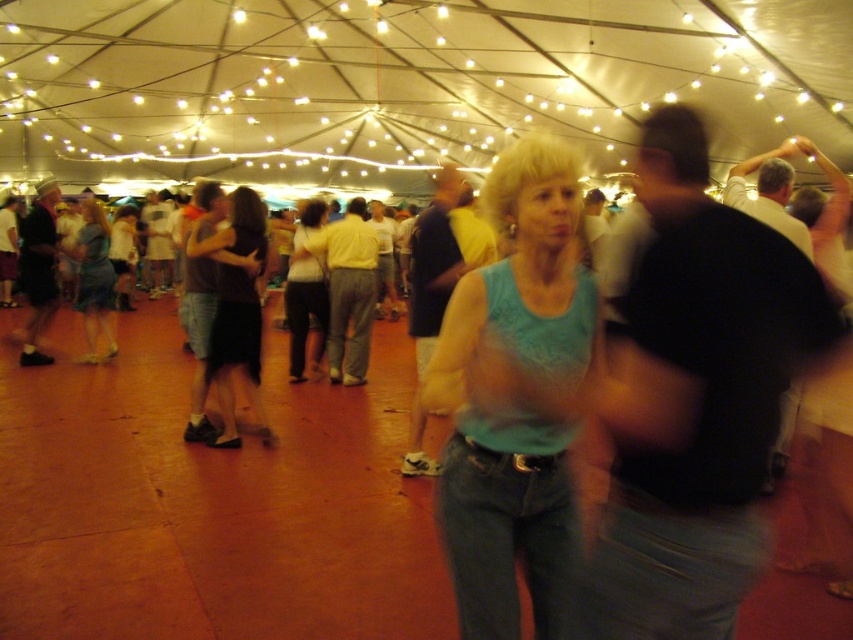
You are standing at the entrance of the tent and want to take a photo of two specific points in the image. The first point is at coordinates point (569, 273) and the second is at point (258, 397). Which point should you focus on first to ensure it appears clearer in your photo?

Point (569, 273) should be focused on first because it is closer to the camera than point (258, 397), so it will appear clearer in the photo.

You are standing at the entrance of the tent and want to locate the teal fabric tank top at center. According to the coordinates provided, in which direction should you look relative to your position?

The teal fabric tank top at center is located at coordinates point (511, 396). Since these coordinates are relative to the image frame, looking towards the center of the image would place you in the correct direction to see it.